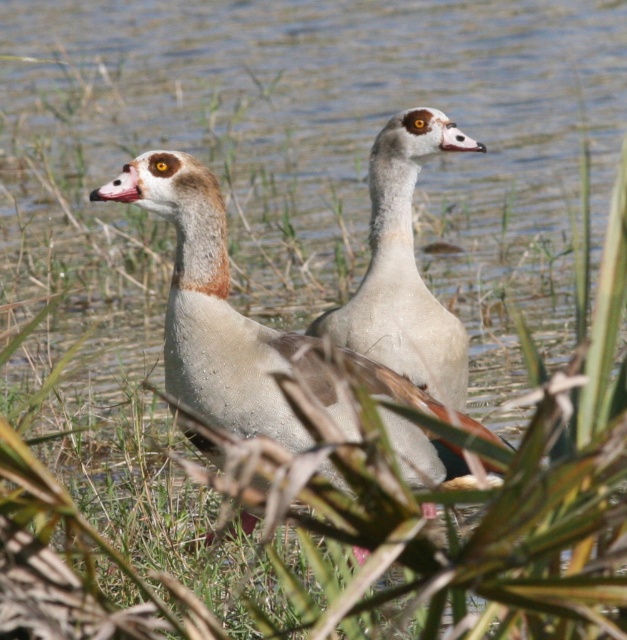
Question: Is white matte duck at center thinner than white matte goose at center?

Choices:
 (A) yes
 (B) no

Answer: (B)

Question: Which point appears farthest from the camera in this image?

Choices:
 (A) (191, 298)
 (B) (398, 355)

Answer: (B)

Question: Is white matte duck at center further to the viewer compared to white matte goose at center?

Choices:
 (A) no
 (B) yes

Answer: (A)

Question: Can you confirm if white matte duck at center is smaller than white matte goose at center?

Choices:
 (A) no
 (B) yes

Answer: (A)